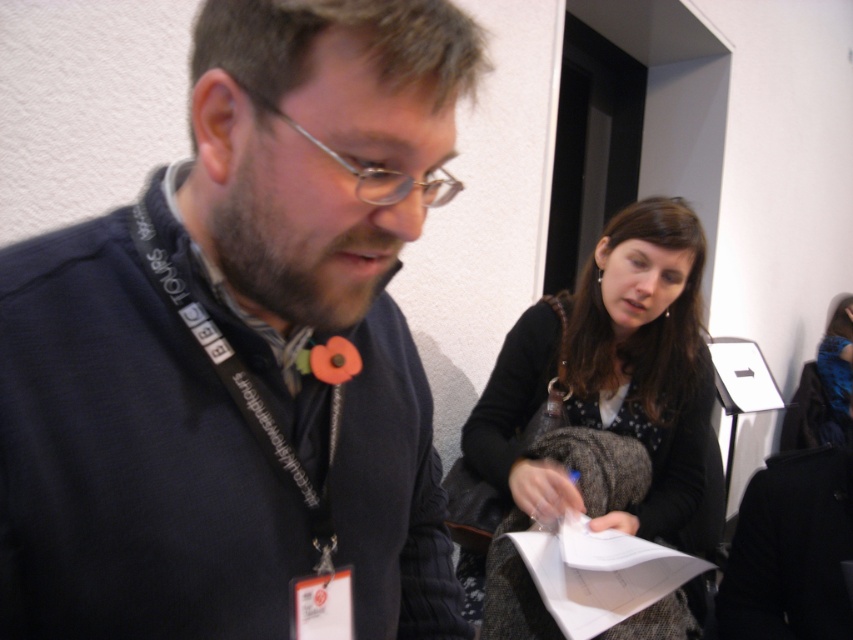
Who is positioned more to the right, dark blue sweater at left or white paper at center?

white paper at center

What do you see at coordinates (242, 349) in the screenshot? I see `dark blue sweater at left` at bounding box center [242, 349].

Locate an element on the screen. dark blue sweater at left is located at coordinates (242, 349).

Between dark blue sweater at left and dark brown textured coat at center, which one appears on the right side from the viewer's perspective?

From the viewer's perspective, dark brown textured coat at center appears more on the right side.

Is dark blue sweater at left closer to the viewer compared to dark brown textured coat at center?

Yes, dark blue sweater at left is in front of dark brown textured coat at center.

Identify the location of dark blue sweater at left. The height and width of the screenshot is (640, 853). (x=242, y=349).

Between dark brown textured coat at center and white paper at center, which one is positioned lower?

white paper at center is below.

Does dark brown textured coat at center appear under white paper at center?

No.

Locate an element on the screen. This screenshot has width=853, height=640. dark brown textured coat at center is located at coordinates (607, 385).